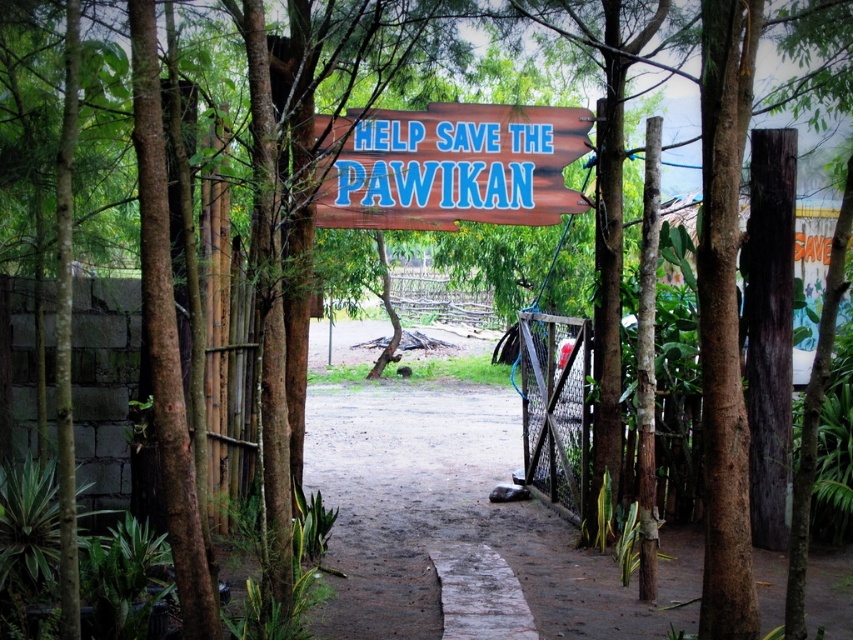
Is dull brown dirt at center smaller than wooden sign at center?

Actually, dull brown dirt at center might be larger than wooden sign at center.

Which is above, dull brown dirt at center or wooden sign at center?

wooden sign at center is above.

I want to click on dull brown dirt at center, so click(x=448, y=515).

You are a GUI agent. You are given a task and a screenshot of the screen. Output one action in this format:
    pyautogui.click(x=<x>, y=<y>)
    Task: Click on the dull brown dirt at center
    Image resolution: width=853 pixels, height=640 pixels.
    Given the screenshot: What is the action you would take?
    pyautogui.click(x=448, y=515)

Is point (399, 216) less distant than point (556, 412)?

Yes, point (399, 216) is in front of point (556, 412).

Is wooden sign at center taller than wire mesh gate at center?

No.

Does point (409, 124) lie behind point (579, 360)?

No, it is not.

You are a GUI agent. You are given a task and a screenshot of the screen. Output one action in this format:
    pyautogui.click(x=<x>, y=<y>)
    Task: Click on the wooden sign at center
    
    Given the screenshot: What is the action you would take?
    pyautogui.click(x=450, y=164)

Who is more forward, [437,426] or [569,378]?

Point [569,378] is more forward.

The height and width of the screenshot is (640, 853). Describe the element at coordinates (448, 515) in the screenshot. I see `dull brown dirt at center` at that location.

Does point (550, 579) lie in front of point (573, 340)?

Yes, it is.

The width and height of the screenshot is (853, 640). What are the coordinates of `dull brown dirt at center` in the screenshot? It's located at (448, 515).